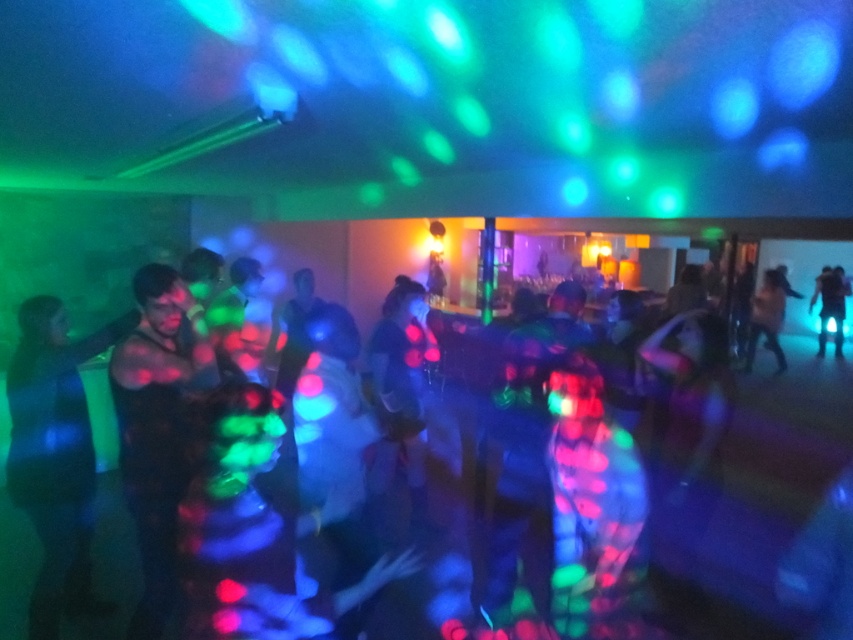
Is shiny metallic tank top at center above blue reflective pants at right?

Actually, shiny metallic tank top at center is below blue reflective pants at right.

Does shiny metallic tank top at center have a lesser height compared to blue reflective pants at right?

Indeed, shiny metallic tank top at center has a lesser height compared to blue reflective pants at right.

Who is more distant from viewer, (200, 385) or (822, 276)?

The point (822, 276) is behind.

The image size is (853, 640). In order to click on shiny metallic tank top at center in this screenshot , I will do `click(157, 428)`.

Which is above, neon glow clothing at center or blue reflective pants at right?

blue reflective pants at right

Does neon glow clothing at center have a larger size compared to blue reflective pants at right?

Yes.

Is point (735, 445) more distant than point (819, 355)?

No, it is in front of (819, 355).

The height and width of the screenshot is (640, 853). In order to click on neon glow clothing at center in this screenshot , I will do `click(767, 486)`.

Does point (64, 356) come farther from viewer compared to point (821, 349)?

No, it is not.

Is shiny blue dress at left wider than blue reflective pants at right?

In fact, shiny blue dress at left might be narrower than blue reflective pants at right.

Is point (32, 428) positioned behind point (839, 337)?

No, it is in front of (839, 337).

Where is `shiny blue dress at left`? The image size is (853, 640). shiny blue dress at left is located at coordinates (55, 456).